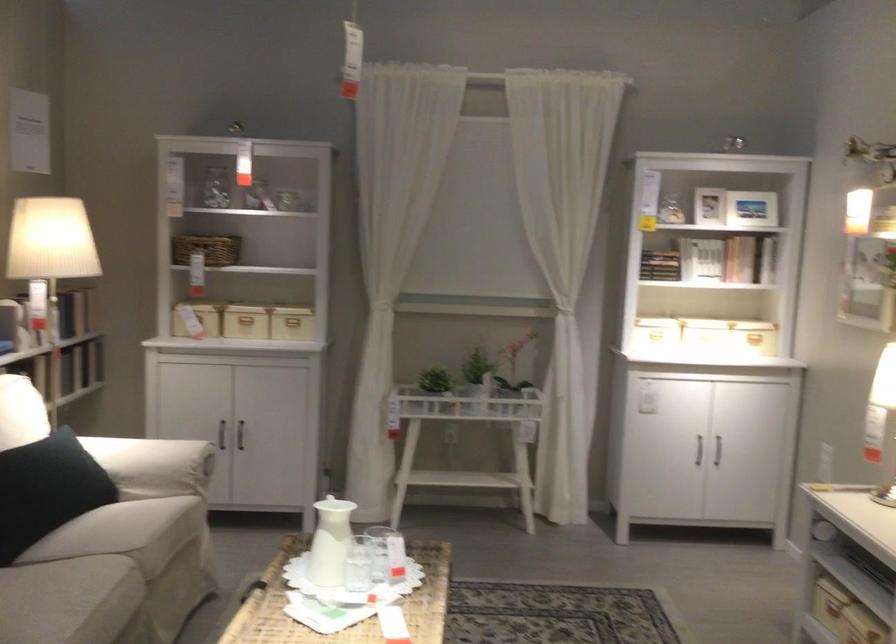
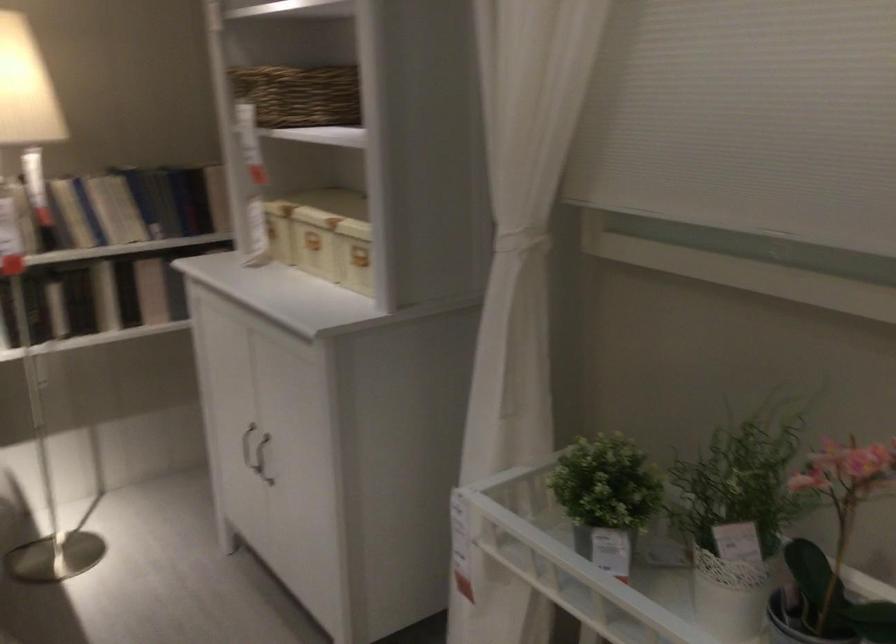
In the second image, find the point that corresponds to the point at 303,317 in the first image.

(354, 254)